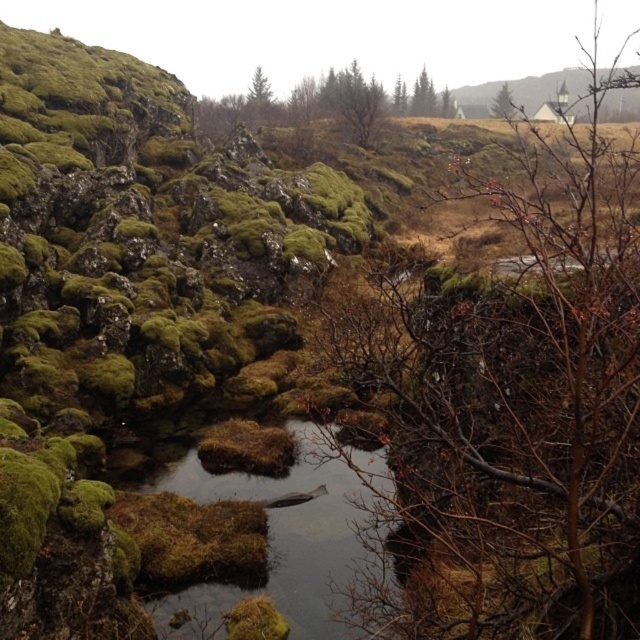
Consider the image. Which of these two, brown leafless branches at center or green mossy stream at center, stands taller?

With more height is brown leafless branches at center.

Which is behind, point (474, 304) or point (285, 566)?

Positioned behind is point (285, 566).

Identify the location of brown leafless branches at center. (513, 410).

You are a GUI agent. You are given a task and a screenshot of the screen. Output one action in this format:
    pyautogui.click(x=<x>, y=<y>)
    Task: Click on the brown leafless branches at center
    This screenshot has width=640, height=640.
    Given the screenshot: What is the action you would take?
    pyautogui.click(x=513, y=410)

Between brown leafless branches at center and green mossy tree at upper right, which one appears on the left side from the viewer's perspective?

Positioned to the left is brown leafless branches at center.

Is brown leafless branches at center shorter than green mossy tree at upper right?

Indeed, brown leafless branches at center has a lesser height compared to green mossy tree at upper right.

Where is `brown leafless branches at center`? The width and height of the screenshot is (640, 640). brown leafless branches at center is located at coordinates (513, 410).

Who is more forward, [380,451] or [256,108]?

Point [380,451] is more forward.

The height and width of the screenshot is (640, 640). Identify the location of green mossy stream at center. (300, 531).